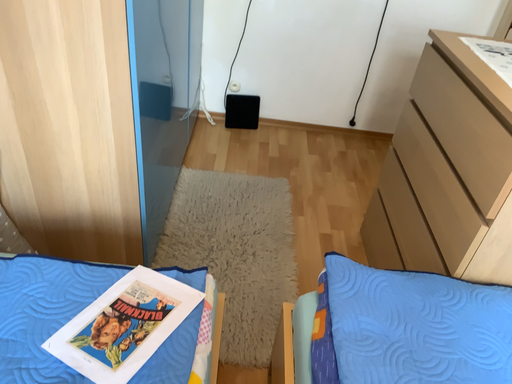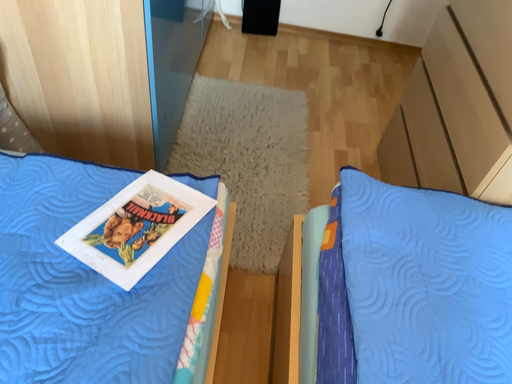
Question: How did the camera likely rotate when shooting the video?

Choices:
 (A) rotated upward
 (B) rotated downward

Answer: (B)